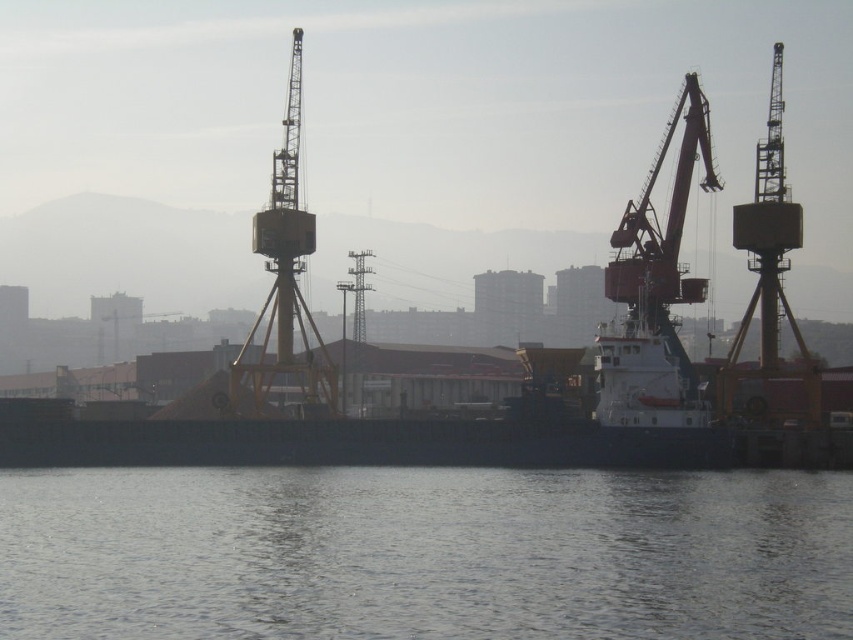
You are a small toy boat that is 1 meter wide. You want to sail from the clear water at lower center to the white matte boat at center. Is there enough space for you to pass through the area between them?

The clear water at lower center might be wider than white matte boat at center, so there is likely enough space for the toy boat to pass through.

You are a sailor who wants to check the water level near your white matte boat at center. According to the scene, where would you look to find the clear water at lower center?

The clear water at lower center is located below the white matte boat at center, so you should look directly beneath the white matte boat at center to find the clear water.

You are a photographer planning to capture the white matte boat at center in the harbor scene. The clear water at lower center is reflecting the boat. Considering the reflection, which object occupies a larger area in the photograph?

The white matte boat at center occupies a larger area in the photograph than the clear water at lower center, as the clear water at lower center has a smaller size compared to the boat.